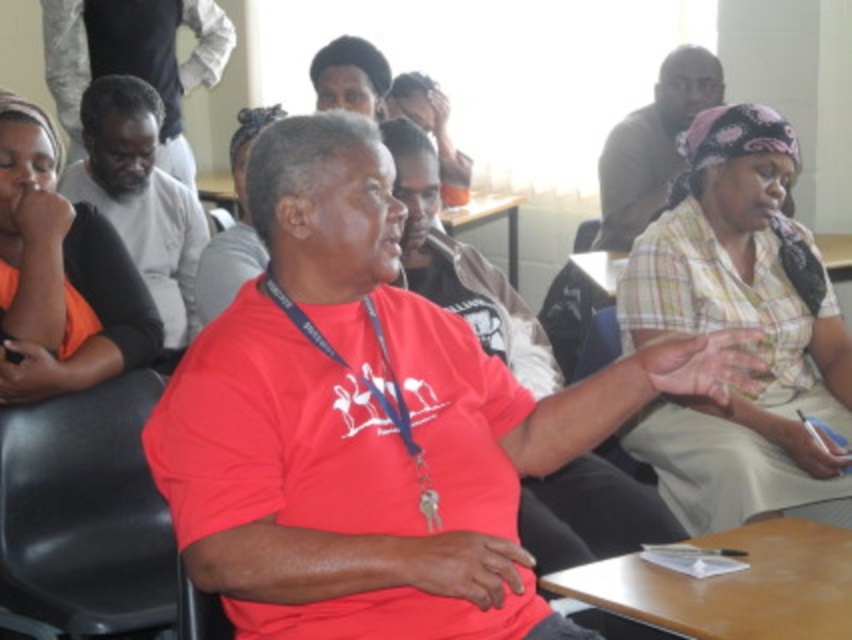
You are standing in the classroom and need to place a small plant between the two points, point [764,637] and point [142,272]. Which point should the plant be closer to in order to be nearer to the front of the room?

The plant should be placed closer to point [142,272] because it is further away from the viewer compared to point [764,637], so positioning it near the latter would be closer to the front.

Looking at this image, you are organizing a seating arrangement for a workshop and need to place a new chair that is the same size as the black plastic chair at left. If you want to place it near the matte black shirt at upper right, will there be enough space?

The black plastic chair at left occupies less space than matte black shirt at upper right, so placing a chair of the same size near the matte black shirt at upper right should be feasible as there is sufficient space available.